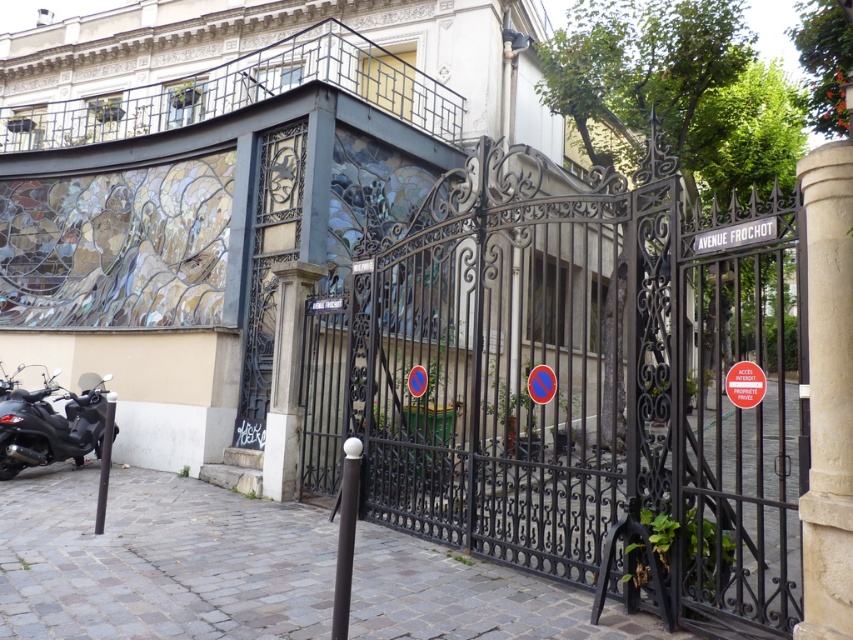
Question: Which of these objects is positioned closest to the polished dark brown pole at center?

Choices:
 (A) paved stone pavement at center
 (B) white stone column at center

Answer: (A)

Question: Which point is farther to the camera?

Choices:
 (A) (282, 476)
 (B) (103, 476)
 (C) (347, 625)

Answer: (A)

Question: Is polished dark brown pole at center closer to the viewer compared to smooth black pole at lower left?

Choices:
 (A) no
 (B) yes

Answer: (B)

Question: Among these points, which one is farthest from the camera?

Choices:
 (A) (390, 618)
 (B) (811, 161)
 (C) (412, 368)
 (D) (349, 586)

Answer: (C)

Question: Considering the relative positions of black matte scooter at lower left and polished dark brown pole at center in the image provided, where is black matte scooter at lower left located with respect to polished dark brown pole at center?

Choices:
 (A) above
 (B) below

Answer: (B)

Question: Can you confirm if paved stone pavement at center is positioned to the right of light beige stone pillar at right?

Choices:
 (A) yes
 (B) no

Answer: (B)